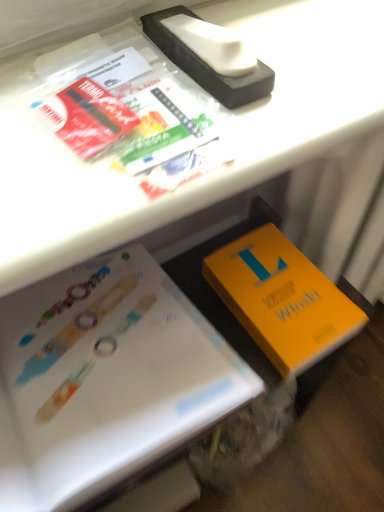
Question: Is white paper at lower left, arranged as the first book when viewed from the left, in front of or behind orange matte book at lower right, marked as the 2th book in a left-to-right arrangement, in the image?

Choices:
 (A) front
 (B) behind

Answer: (A)

Question: Is point [x=14, y=352] positioned closer to the camera than point [x=249, y=275]?

Choices:
 (A) farther
 (B) closer

Answer: (B)

Question: Considering the positions of white paper at lower left, which appears as the 2th book when viewed from the right, and orange matte book at lower right, marked as the 2th book in a left-to-right arrangement, in the image, is white paper at lower left, which appears as the 2th book when viewed from the right, wider or thinner than orange matte book at lower right, marked as the 2th book in a left-to-right arrangement,?

Choices:
 (A) wide
 (B) thin

Answer: (A)

Question: Is point (211, 279) closer or farther from the camera than point (195, 339)?

Choices:
 (A) closer
 (B) farther

Answer: (B)

Question: Considering the positions of orange matte book at lower right, which is the first book from right to left, and white paper at lower left, which appears as the 2th book when viewed from the right, in the image, is orange matte book at lower right, which is the first book from right to left, taller or shorter than white paper at lower left, which appears as the 2th book when viewed from the right,?

Choices:
 (A) short
 (B) tall

Answer: (A)

Question: Visually, is orange matte book at lower right, marked as the 2th book in a left-to-right arrangement, positioned to the left or to the right of white paper at lower left, arranged as the first book when viewed from the left?

Choices:
 (A) left
 (B) right

Answer: (B)

Question: From the image's perspective, relative to white paper at lower left, which appears as the 2th book when viewed from the right, is orange matte book at lower right, marked as the 2th book in a left-to-right arrangement, above or below?

Choices:
 (A) above
 (B) below

Answer: (A)